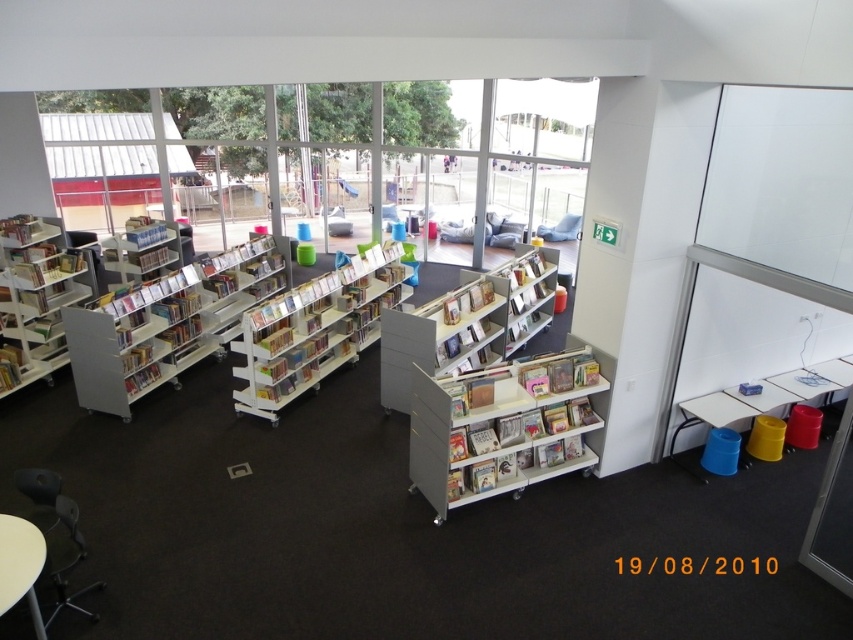
Question: Is white plastic shelves at center further to camera compared to hardcover book at lower left?

Choices:
 (A) no
 (B) yes

Answer: (B)

Question: Among these objects, which one is nearest to the camera?

Choices:
 (A) matte plastic bookshelf at center
 (B) white plastic bookshelf at center
 (C) white plastic bookcase at center

Answer: (C)

Question: Is white glossy bookshelf at left to the left of matte plastic bookshelf at center from the viewer's perspective?

Choices:
 (A) no
 (B) yes

Answer: (B)

Question: Which point is farther from the camera taking this photo?

Choices:
 (A) [247, 355]
 (B) [138, 362]
 (C) [250, 211]

Answer: (C)

Question: Is transparent glass window at upper center bigger than white plastic shelves at center?

Choices:
 (A) yes
 (B) no

Answer: (A)

Question: Which point is closer to the camera?

Choices:
 (A) white plastic shelves at center
 (B) white plastic bookcase at center
 (C) white glossy bookshelf at left

Answer: (B)